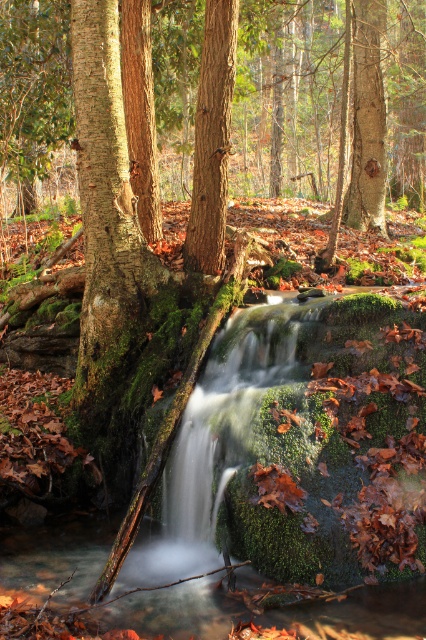
Question: Which of the following is the closest to the observer?

Choices:
 (A) (212, 225)
 (B) (359, 221)

Answer: (A)

Question: Which point appears farthest from the camera in this image?

Choices:
 (A) (215, 225)
 (B) (363, 140)

Answer: (B)

Question: From the image, what is the correct spatial relationship of smooth brown tree trunk at center in relation to rough bark tree trunk at upper center?

Choices:
 (A) left
 (B) right

Answer: (A)

Question: Is smooth brown tree trunk at center smaller than rough bark tree trunk at upper center?

Choices:
 (A) no
 (B) yes

Answer: (B)

Question: Which point is closer to the camera taking this photo?

Choices:
 (A) (371, 6)
 (B) (213, 272)

Answer: (B)

Question: In this image, where is smooth brown tree trunk at center located relative to rough bark tree trunk at upper center?

Choices:
 (A) right
 (B) left

Answer: (B)